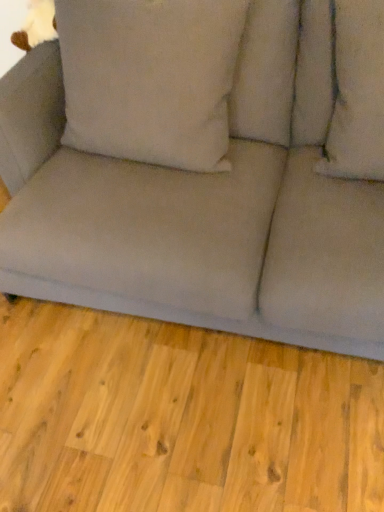
Question: Relative to soft beige cushion at upper right, which ranks as the second pillow in left-to-right order, is beige fabric pillow at center, which is counted as the first pillow, starting from the left, in front or behind?

Choices:
 (A) behind
 (B) front

Answer: (A)

Question: Considering the positions of beige fabric pillow at center, the second pillow from the right, and soft beige cushion at upper right, which ranks as the second pillow in left-to-right order, in the image, is beige fabric pillow at center, the second pillow from the right, wider or thinner than soft beige cushion at upper right, which ranks as the second pillow in left-to-right order,?

Choices:
 (A) wide
 (B) thin

Answer: (B)

Question: Based on their relative distances, which object is nearer to the beige fabric pillow at center, the second pillow from the right?

Choices:
 (A) matte gray couch at center
 (B) soft beige cushion at upper right, the first pillow positioned from the right
 (C) gray fabric couch at lower center

Answer: (A)

Question: Estimate the real-world distances between objects in this image. Which object is farther from the gray fabric couch at lower center?

Choices:
 (A) soft beige cushion at upper right, which ranks as the second pillow in left-to-right order
 (B) beige fabric pillow at center, which is counted as the first pillow, starting from the left
 (C) matte gray couch at center

Answer: (A)